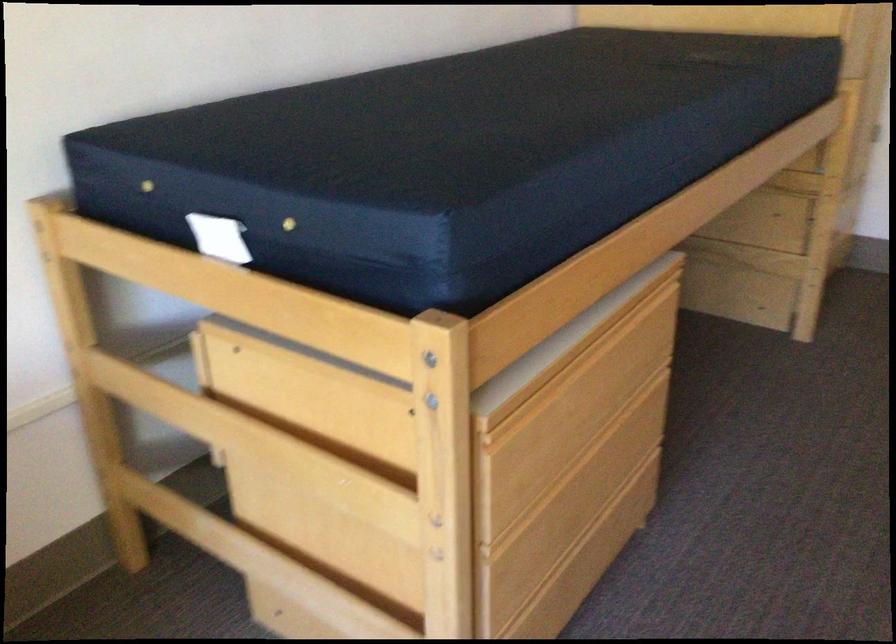
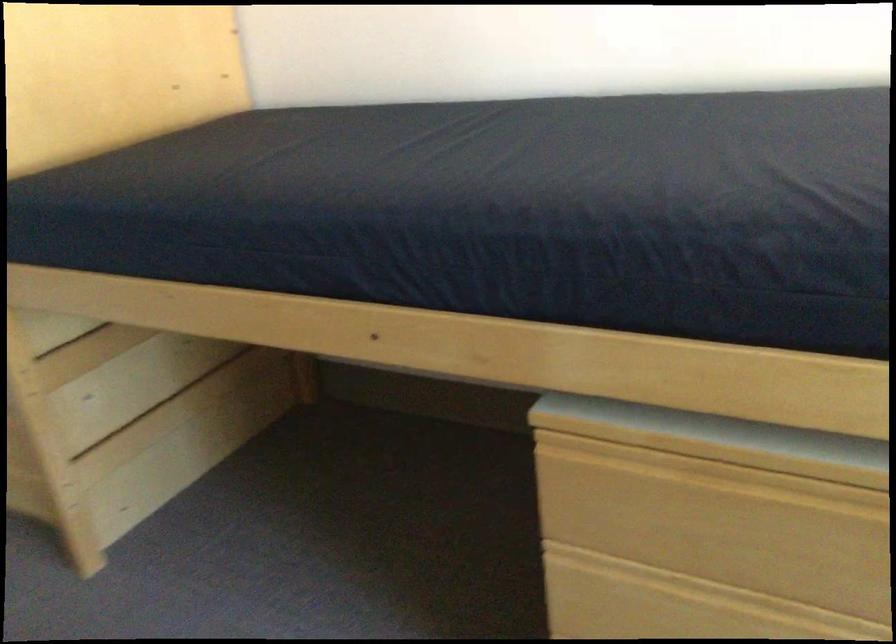
First-person continuous shooting, in which direction is the camera rotating?

The camera rotated toward right-down.